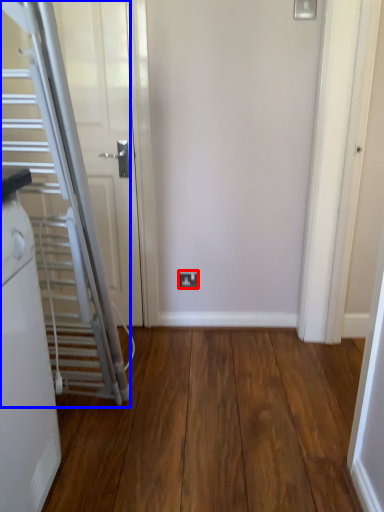
Question: Which object appears farthest to the camera in this image, electric outlet (highlighted by a red box) or escalator (highlighted by a blue box)?

Choices:
 (A) electric outlet
 (B) escalator

Answer: (A)